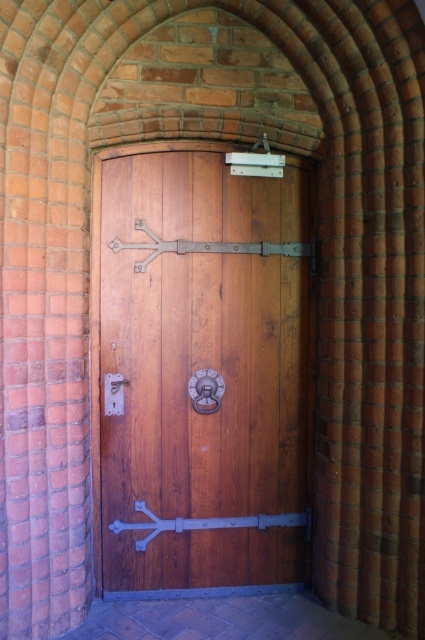
Question: Which object is farther from the camera taking this photo?

Choices:
 (A) matte silver lock at center
 (B) wooden door at center

Answer: (A)

Question: Which point is farther from the camera taking this photo?

Choices:
 (A) (116, 378)
 (B) (136, 508)

Answer: (B)

Question: Does wooden door at center have a larger size compared to matte silver lock at center?

Choices:
 (A) yes
 (B) no

Answer: (A)

Question: Does wooden door at center lie behind matte silver lock at center?

Choices:
 (A) no
 (B) yes

Answer: (A)

Question: Among these points, which one is nearest to the camera?

Choices:
 (A) (200, 438)
 (B) (121, 400)

Answer: (B)

Question: Is wooden door at center smaller than matte silver lock at center?

Choices:
 (A) no
 (B) yes

Answer: (A)